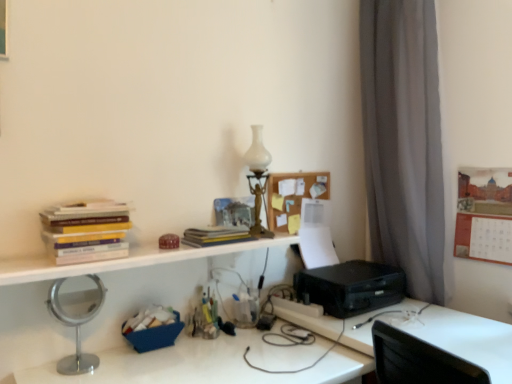
Image resolution: width=512 pixels, height=384 pixels. What do you see at coordinates (215, 236) in the screenshot? I see `hardcover book at center` at bounding box center [215, 236].

Identify the location of wooden corkboard at upper center. The image size is (512, 384). (292, 197).

The image size is (512, 384). I want to click on bookshelf located underneath the hardcover books at upper left (from a real-world perspective), so click(x=120, y=261).

Is hardcover books at upper left to the left or to the right of white matte bookshelf at upper center in the image?

In the image, hardcover books at upper left appears on the left side of white matte bookshelf at upper center.

Is the position of hardcover books at upper left more distant than that of white matte bookshelf at upper center?

Yes.

Is point (255, 173) closer or farther from the camera than point (77, 349)?

Clearly, point (255, 173) is more distant from the camera than point (77, 349).

From the image's perspective, between white glass table lamp at upper center and silver metallic mirror at left, which one is located above?

white glass table lamp at upper center.

Is white glass table lamp at upper center turned away from silver metallic mirror at left?

No.

Which object is closer to the camera taking this photo, white glass table lamp at upper center or silver metallic mirror at left?

silver metallic mirror at left is in front.

Is the depth of hardcover books at upper left less than that of wooden corkboard at upper center?

Yes, the depth of hardcover books at upper left is less than that of wooden corkboard at upper center.

Based on the photo, is hardcover books at upper left thinner than wooden corkboard at upper center?

Incorrect, the width of hardcover books at upper left is not less than that of wooden corkboard at upper center.

Is point (77, 259) closer to camera compared to point (329, 189)?

That is True.

From the picture: From the image's perspective, between hardcover books at upper left and wooden corkboard at upper center, which one is located above?

wooden corkboard at upper center, from the image's perspective.

Is black plastic printer at right located outside silver metallic mirror at left?

Indeed, black plastic printer at right is completely outside silver metallic mirror at left.

Can you confirm if black plastic printer at right is shorter than silver metallic mirror at left?

Yes.

Locate an element on the screen. The height and width of the screenshot is (384, 512). printer behind the silver metallic mirror at left is located at coordinates (351, 287).

In the scene shown: Can you confirm if black plastic printer at right is positioned to the right of silver metallic mirror at left?

Indeed, black plastic printer at right is positioned on the right side of silver metallic mirror at left.

Which is further, (189, 239) or (100, 202)?

Point (189, 239)

From the image's perspective, which one is positioned higher, hardcover book at center or hardcover books at upper left?

hardcover books at upper left, from the image's perspective.

Considering the sizes of objects hardcover book at center and hardcover books at upper left in the image provided, who is smaller, hardcover book at center or hardcover books at upper left?

With smaller size is hardcover book at center.

Is point (317, 318) closer to viewer compared to point (74, 360)?

No.

Between black plastic printer at lower right and silver metallic mirror at left, which one appears on the right side from the viewer's perspective?

Positioned to the right is black plastic printer at lower right.

Can you confirm if black plastic printer at lower right is wider than silver metallic mirror at left?

Yes.

At what (x,y) coordinates should I click in order to perform the action: click on mirror above the black plastic printer at lower right (from a real-world perspective). Please return your answer as a coordinate pair (x, y). Image resolution: width=512 pixels, height=384 pixels. Looking at the image, I should click on (76, 328).

Does wooden bulletin board at upper right have a larger size compared to black plastic printer at right?

No, wooden bulletin board at upper right is not bigger than black plastic printer at right.

Is point (500, 238) in front of point (334, 269)?

Yes, point (500, 238) is in front of point (334, 269).

The image size is (512, 384). I want to click on book lying on the left of white matte bookshelf at upper center, so click(x=86, y=231).

The image size is (512, 384). I want to click on mirror that appears in front of the white glass table lamp at upper center, so click(76, 328).

Looking at the image, which one is located closer to white matte bookshelf at upper center, black plastic printer at right or white glass table lamp at upper center?

The object closer to white matte bookshelf at upper center is white glass table lamp at upper center.

Considering their positions, is wooden corkboard at upper center positioned closer to matte brown box at center, which is the third stationery in bottom-to-top order, than silver metallic mirror at lower left?

wooden corkboard at upper center is closer to matte brown box at center, which is the third stationery in bottom-to-top order.

Estimate the real-world distances between objects in this image. Which object is further from translucent plastic container at center, which is the second stationery in top-to-bottom order, hardcover books at upper left or black plastic printer at right?

black plastic printer at right is positioned further to the anchor translucent plastic container at center, which is the second stationery in top-to-bottom order.

When comparing their distances from silver metallic mirror at left, does translucent plastic container at center, which is the 2th stationery in bottom-to-top order, or silver metallic mirror at lower left seem further?

silver metallic mirror at lower left is positioned further to the anchor silver metallic mirror at left.

Based on their spatial positions, is white glass table lamp at upper center or hardcover book at center closer to wooden corkboard at upper center?

The object closer to wooden corkboard at upper center is white glass table lamp at upper center.

Which object lies further to the anchor point blue fabric basket at lower left, which is counted as the first stationery, starting from the bottom, black plastic printer at lower right or hardcover books at upper left?

Among the two, black plastic printer at lower right is located further to blue fabric basket at lower left, which is counted as the first stationery, starting from the bottom.

Looking at the image, which one is located further to black plastic printer at right, wooden corkboard at upper center or silver metallic mirror at lower left?

Based on the image, wooden corkboard at upper center appears to be further to black plastic printer at right.

When comparing their distances from wooden corkboard at upper center, does silver metallic mirror at lower left or translucent plastic container at center, which is the 2th stationery in bottom-to-top order, seem further?

The object further to wooden corkboard at upper center is silver metallic mirror at lower left.

Find the location of a particular element. Image resolution: width=512 pixels, height=384 pixels. paperback book between hardcover books at upper left and blue fabric basket at lower left, the 3th stationery in the top-to-bottom sequence, in the up-down direction is located at coordinates (215, 236).

The height and width of the screenshot is (384, 512). Identify the location of table lamp between hardcover books at upper left and wooden corkboard at upper center from left to right. (258, 178).

In order to click on table lamp situated between hardcover books at upper left and wooden bulletin board at upper right from left to right in this screenshot , I will do `click(258, 178)`.

Where is `bookshelf between silver metallic mirror at left and hardcover book at center from left to right`? This screenshot has width=512, height=384. bookshelf between silver metallic mirror at left and hardcover book at center from left to right is located at coordinates (120, 261).